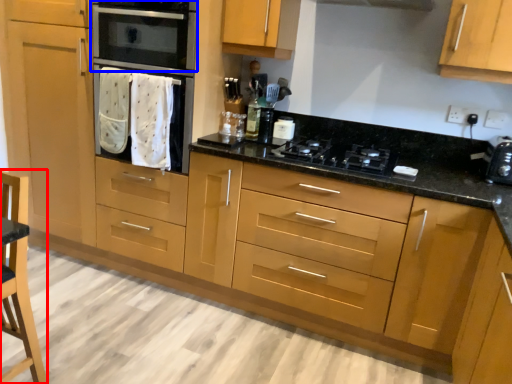
Question: Among these objects, which one is farthest to the camera, armchair (highlighted by a red box) or home appliance (highlighted by a blue box)?

Choices:
 (A) armchair
 (B) home appliance

Answer: (B)